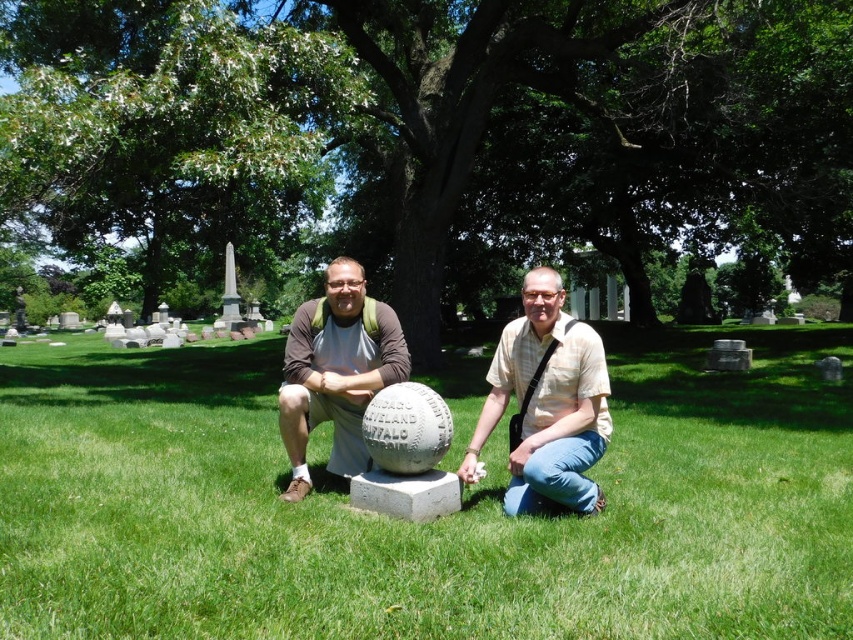
You are standing in a cemetery and see the green grass at center and the light brown textured shirt at center. Which object is closer to you?

The green grass at center is closer to you because it is in front of the light brown textured shirt at center.

You are planning to place a small flower pot between the green grass at center and the white stone baseball at center. Since the flower pot is 10 cm wide, will there be enough space between them to fit it?

The green grass at center is wider than the white stone baseball at center. However, the description only mentions their widths relative to each other but does not provide specific measurements. Without knowing the exact width of the space between them, it is impossible to determine if the 10 cm flower pot will fit.

You are standing at point (288, 392) and want to walk to the baseball field. There is a path leading to point (527, 486). Is this path going in the correct direction towards the baseball field?

Point (527, 486) is in front of point (288, 392), so yes, the path leading to point (527, 486) is going in the correct direction towards the baseball field.